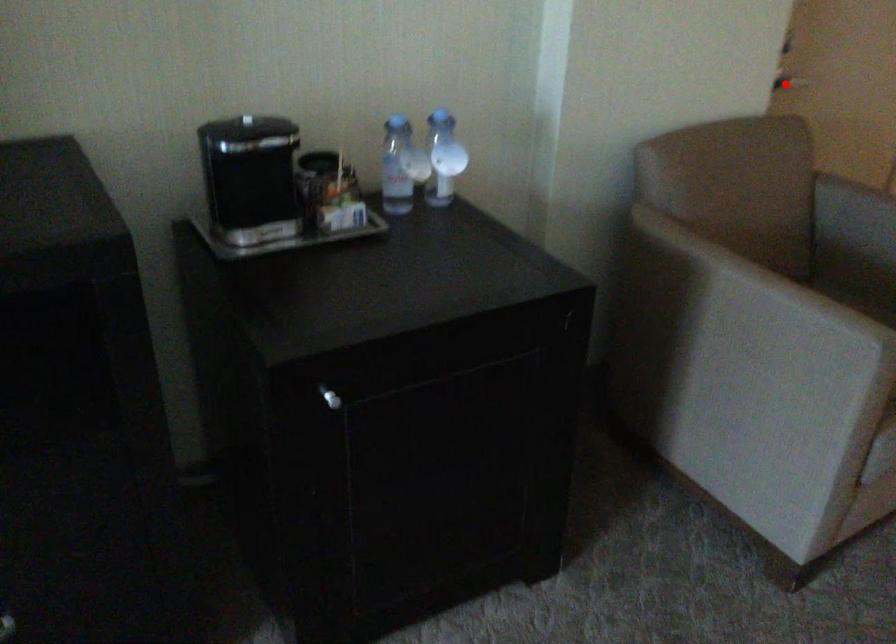
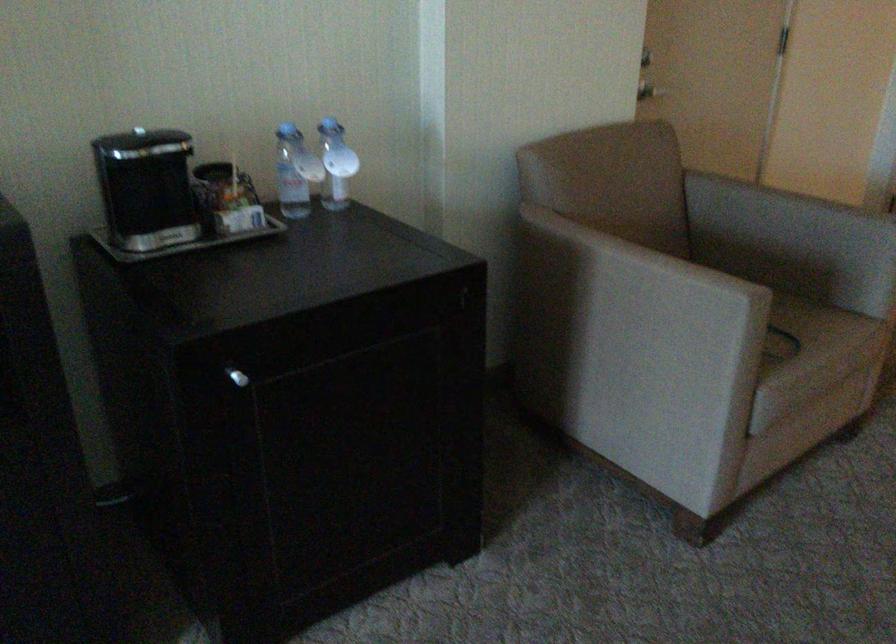
Locate, in the second image, the point that corresponds to the highlighted location in the first image.

(649, 90)